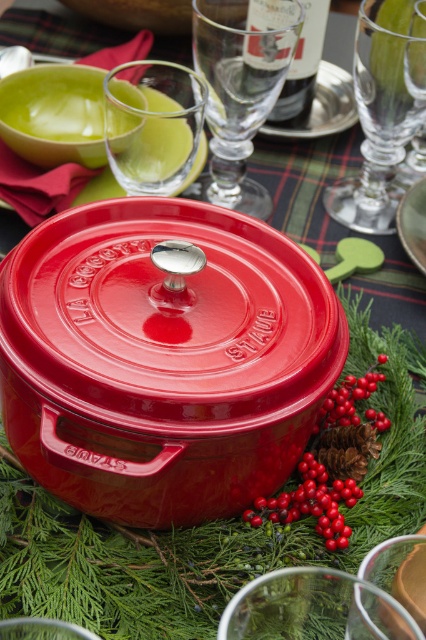
What is the relationship between the width of the matte red cocotte at center and the transparent glass at upper center?

The matte red cocotte at center is wider than the transparent glass at upper center.

You are setting up a holiday table and want to place a decorative centerpiece between the transparent glass wine glass at upper center and the transparent glass at upper center. Can you fit it there if the centerpiece is 2 inches wide?

The transparent glass wine glass at upper center and transparent glass at upper center are 2.68 inches apart from each other. Since the centerpiece is 2 inches wide, it can fit between them as there is enough space.

You are a guest at the table and want to place a small ornament on the tallest object between the matte red cocotte at center and the dark glass bottle at upper center. Which object should you choose?

The matte red cocotte at center is taller than the dark glass bottle at upper center, so you should place the ornament on the matte red cocotte at center.